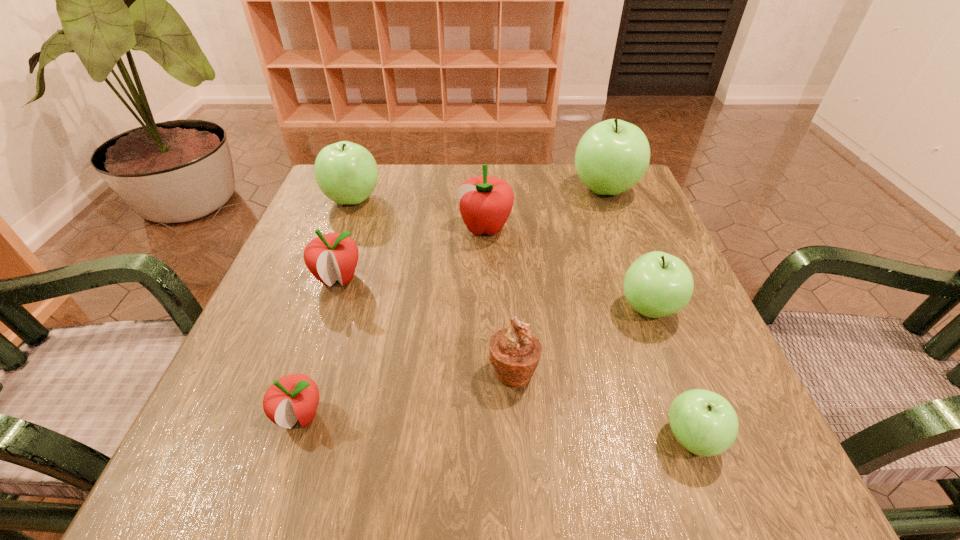
You are a GUI agent. You are given a task and a screenshot of the screen. Output one action in this format:
    pyautogui.click(x=<x>, y=<y>)
    Task: Click on the apple that can be found as the second closest to the second smallest red apple
    This screenshot has height=540, width=960.
    Given the screenshot: What is the action you would take?
    pyautogui.click(x=485, y=202)

Identify which apple is the sixth nearest to the farthest red apple. Please provide its 2D coordinates. Your answer should be formatted as a tuple, i.e. [(x, y)], where the tuple contains the x and y coordinates of a point satisfying the conditions above.

[(703, 422)]

The width and height of the screenshot is (960, 540). Identify the location of green apple that is the second nearest to the leftmost green apple. (657, 284).

The width and height of the screenshot is (960, 540). Find the location of `green apple object that ranks as the third closest to the nearest red apple`. green apple object that ranks as the third closest to the nearest red apple is located at coordinates (657, 284).

Find the location of `red apple object that ranks as the second closest to the third farthest green apple`. red apple object that ranks as the second closest to the third farthest green apple is located at coordinates (329, 257).

Select which red apple appears as the second closest to the second biggest red apple. Please provide its 2D coordinates. Your answer should be formatted as a tuple, i.e. [(x, y)], where the tuple contains the x and y coordinates of a point satisfying the conditions above.

[(295, 397)]

Image resolution: width=960 pixels, height=540 pixels. Identify the location of vacant space that satisfies the following two spatial constraints: 1. on the front side of the leftmost green apple; 2. on the left side of the smallest green apple. (262, 438).

Where is `vacant area in the image that satisfies the following two spatial constraints: 1. on the front side of the second smallest green apple; 2. on the right side of the second nearest red apple`? The image size is (960, 540). vacant area in the image that satisfies the following two spatial constraints: 1. on the front side of the second smallest green apple; 2. on the right side of the second nearest red apple is located at coordinates (328, 308).

Find the location of a particular element. The image size is (960, 540). free space that satisfies the following two spatial constraints: 1. on the back side of the nearest green apple; 2. on the right side of the second smallest green apple is located at coordinates (644, 308).

Identify the location of vacant region that satisfies the following two spatial constraints: 1. on the back side of the biggest green apple; 2. on the right side of the smallest green apple. The image size is (960, 540). (600, 190).